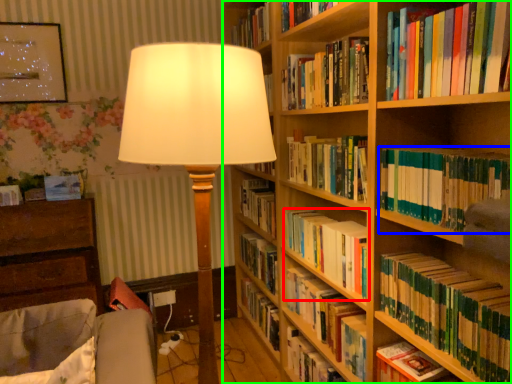
Question: Which object is positioned farthest from book (highlighted by a red box)? Select from book (highlighted by a blue box) and bookcase (highlighted by a green box).

Choices:
 (A) book
 (B) bookcase

Answer: (A)